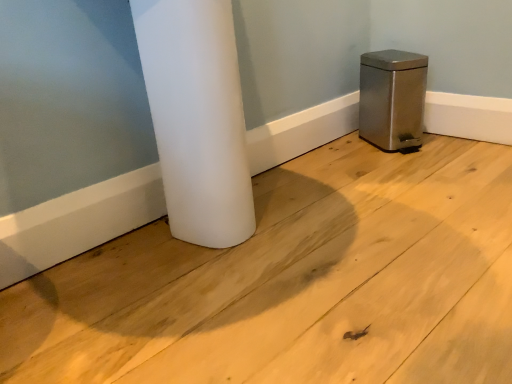
Locate an element on the screen. The width and height of the screenshot is (512, 384). brushed metal trash can at right is located at coordinates (392, 98).

This screenshot has height=384, width=512. What do you see at coordinates (392, 98) in the screenshot? I see `brushed metal trash can at right` at bounding box center [392, 98].

Find the location of a particular element. The width and height of the screenshot is (512, 384). brushed metal trash can at right is located at coordinates (392, 98).